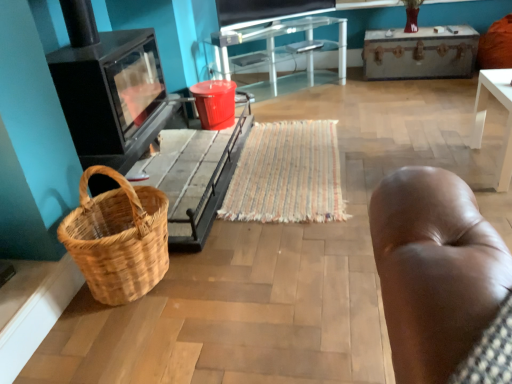
Identify the location of vacant region above wooden trunk at upper right, the 2th table positioned from the front (from a real-world perspective). The image size is (512, 384). (421, 29).